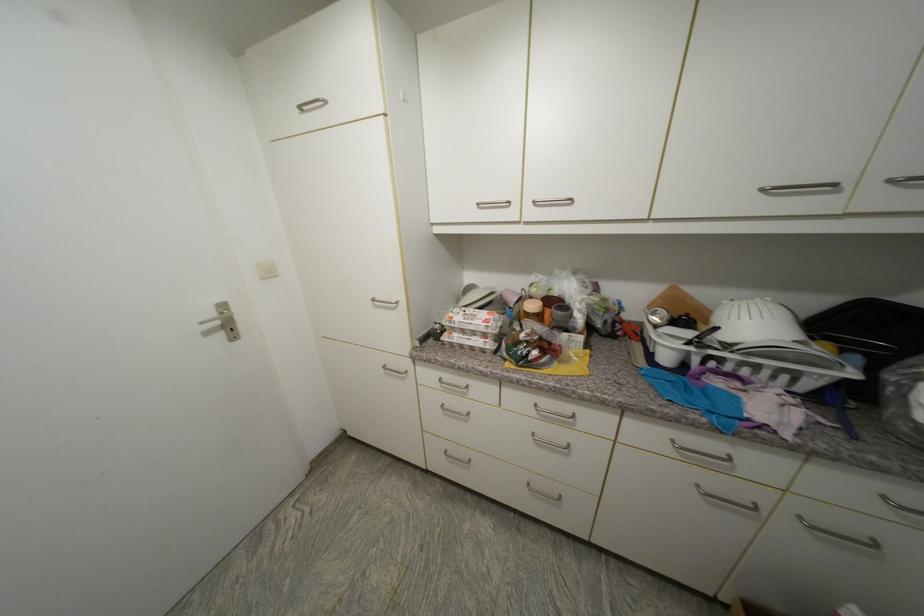
At what (x,y) coordinates should I click in order to perform the action: click on brown glass jar. Please return your answer as a coordinate pair (x, y). This screenshot has width=924, height=616. Looking at the image, I should click on (531, 310).